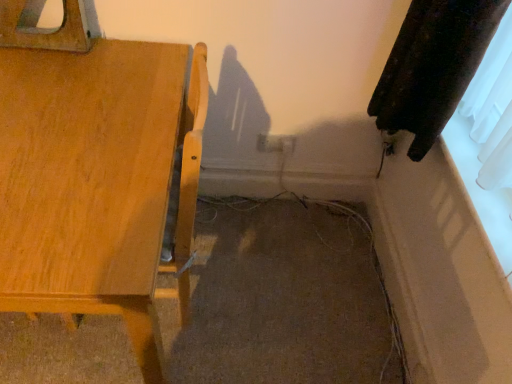
In order to face white plastic electric outlet at center, should I rotate leftwards or rightwards?

It's best to rotate right around 3.387 degrees.

What do you see at coordinates (276, 143) in the screenshot? I see `white plastic electric outlet at center` at bounding box center [276, 143].

I want to click on white plastic electric outlet at center, so click(276, 143).

Locate an element on the screen. This screenshot has height=384, width=512. wooden table at left is located at coordinates (95, 171).

The width and height of the screenshot is (512, 384). Describe the element at coordinates (95, 171) in the screenshot. I see `wooden table at left` at that location.

This screenshot has height=384, width=512. What are the coordinates of `white plastic electric outlet at center` in the screenshot? It's located at [276, 143].

Is wooden table at left to the right of white plastic electric outlet at center from the viewer's perspective?

Incorrect, wooden table at left is not on the right side of white plastic electric outlet at center.

Is the position of wooden table at left less distant than that of white plastic electric outlet at center?

Yes, it is in front of white plastic electric outlet at center.

Does point (14, 209) come in front of point (291, 144)?

Yes, it is in front of point (291, 144).

From the image's perspective, which one is positioned lower, wooden table at left or white plastic electric outlet at center?

wooden table at left, from the image's perspective.

Consider the image. From a real-world perspective, which object stands above the other?

wooden table at left.

Looking at their sizes, would you say wooden table at left is wider or thinner than white plastic electric outlet at center?

wooden table at left is wider than white plastic electric outlet at center.

From their relative heights in the image, would you say wooden table at left is taller or shorter than white plastic electric outlet at center?

Considering their sizes, wooden table at left has more height than white plastic electric outlet at center.

Considering the sizes of objects wooden table at left and white plastic electric outlet at center in the image provided, who is bigger, wooden table at left or white plastic electric outlet at center?

wooden table at left is bigger.

Is wooden table at left outside of white plastic electric outlet at center?

Yes.

Is wooden table at left next to white plastic electric outlet at center?

They are not placed beside each other.

Could you tell me if wooden table at left is facing white plastic electric outlet at center?

No.

Measure the distance from wooden table at left to white plastic electric outlet at center.

wooden table at left and white plastic electric outlet at center are 31.53 inches apart.

What are the coordinates of `electric outlet behind the wooden table at left` in the screenshot? It's located at (276, 143).

Considering the relative positions of white plastic electric outlet at center and wooden table at left in the image provided, is white plastic electric outlet at center to the right of wooden table at left from the viewer's perspective?

Indeed, white plastic electric outlet at center is positioned on the right side of wooden table at left.

In the image, is white plastic electric outlet at center positioned in front of or behind wooden table at left?

white plastic electric outlet at center is behind wooden table at left.

Does point (291, 146) lie behind point (179, 91)?

Yes, it is.

From the image's perspective, between white plastic electric outlet at center and wooden table at left, who is located below?

wooden table at left, from the image's perspective.

Based on the photo, from a real-world perspective, is white plastic electric outlet at center positioned above or below wooden table at left?

From a real-world perspective, white plastic electric outlet at center is physically below wooden table at left.

Considering the sizes of objects white plastic electric outlet at center and wooden table at left in the image provided, who is thinner, white plastic electric outlet at center or wooden table at left?

white plastic electric outlet at center is thinner.

Considering the sizes of objects white plastic electric outlet at center and wooden table at left in the image provided, who is taller, white plastic electric outlet at center or wooden table at left?

wooden table at left.

Between white plastic electric outlet at center and wooden table at left, which one has larger size?

wooden table at left.

Can we say white plastic electric outlet at center lies outside wooden table at left?

Yes, white plastic electric outlet at center is located beyond the bounds of wooden table at left.

Is the surface of white plastic electric outlet at center in direct contact with wooden table at left?

white plastic electric outlet at center and wooden table at left are clearly separated.

Could you tell me if white plastic electric outlet at center is facing wooden table at left?

No, white plastic electric outlet at center is not facing towards wooden table at left.

Locate an element on the screen. The image size is (512, 384). furniture on the left of white plastic electric outlet at center is located at coordinates (95, 171).

I want to click on furniture that is above the white plastic electric outlet at center (from a real-world perspective), so click(x=95, y=171).

Identify the location of electric outlet on the right of the wooden table at left. This screenshot has height=384, width=512. (276, 143).